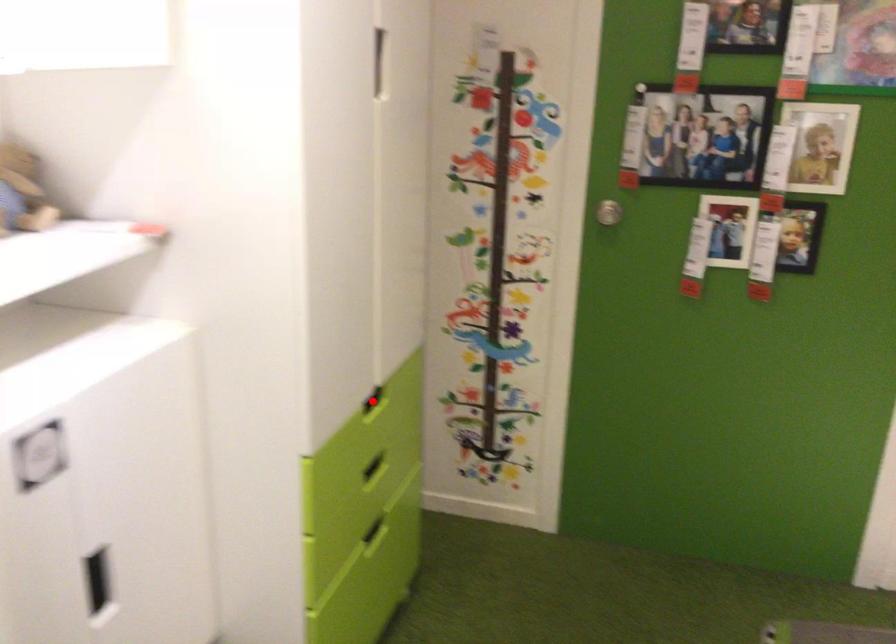
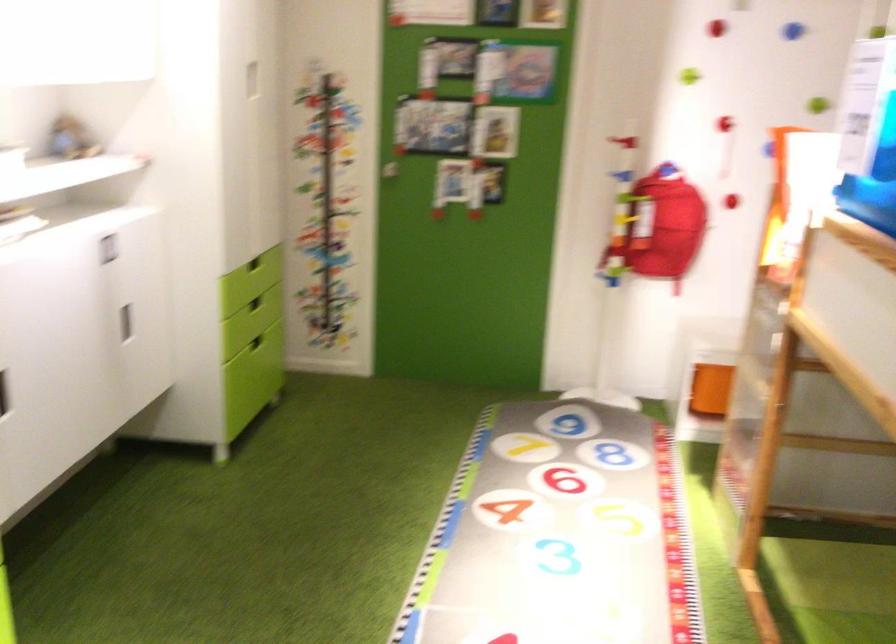
Question: I am providing you with two images of the same scene from different viewpoints. In image1, a red point is highlighted. Considering the same 3D point in image2, which of the following is correct?

Choices:
 (A) It is closer
 (B) It is farther

Answer: (B)